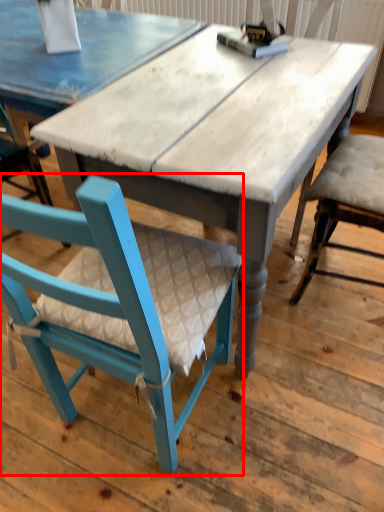
Question: Considering the relative positions of chair (annotated by the red box) and table in the image provided, where is chair (annotated by the red box) located with respect to the staircase?

Choices:
 (A) left
 (B) right

Answer: (A)